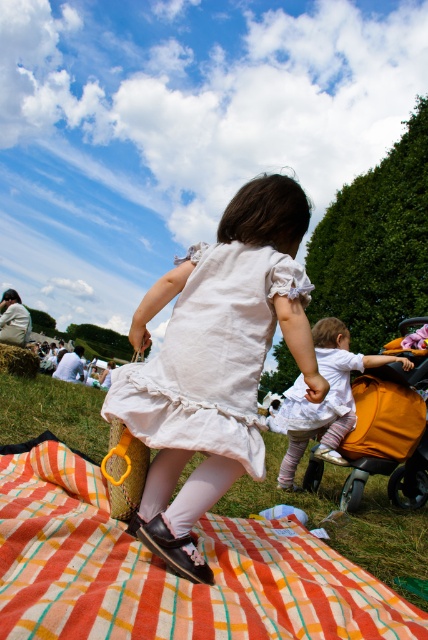
You are standing at the picnic area and see the point marked at coordinates (210, 356). Which object is this point located on?

The point at coordinates (210, 356) is located on the white cotton dress at center.

You are a photographer standing in front of the scene. You want to take a photo that focuses on the plaid fabric quilt at center and the white cotton dress at center. Which object should you zoom in on to make it appear larger in the photo?

To make the plaid fabric quilt at center appear larger in the photo, you should zoom in on it since it is closer to the viewer than the white cotton dress at center.

You are planning to set up a picnic area for a family gathering. You have a plaid fabric quilt at center and an orange fabric baby carriage at lower right. Which item should you choose if you want to cover a larger area for seating?

The plaid fabric quilt at center should be chosen because its width is larger than the orange fabric baby carriage at lower right, making it more suitable for covering a larger seating area.